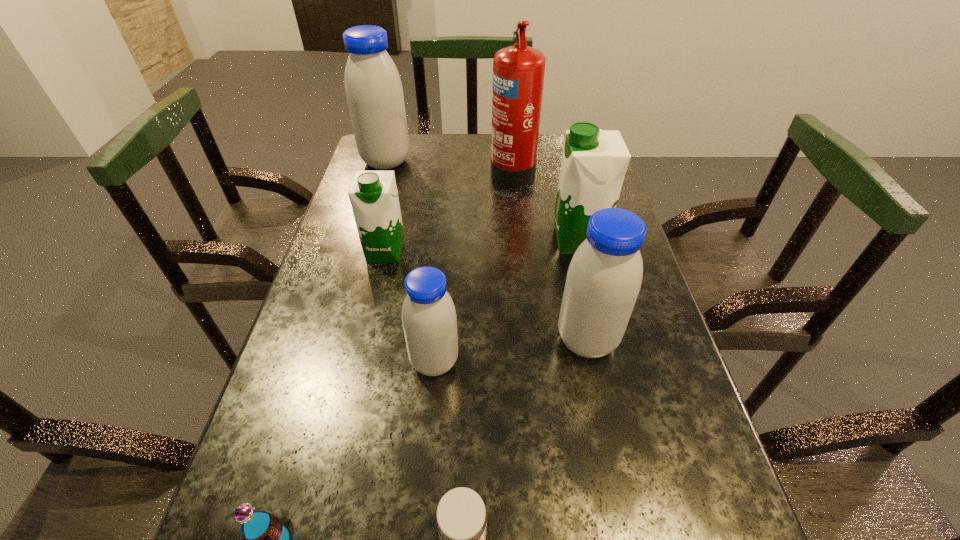
Locate an element on the screen. Image resolution: width=960 pixels, height=540 pixels. red fire extinguisher is located at coordinates (518, 71).

Locate an element on the screen. This screenshot has width=960, height=540. the biggest blue soya milk is located at coordinates (373, 87).

Identify the location of the seventh shortest object. (373, 87).

In order to click on the bigger green soya milk in this screenshot , I will do `click(594, 161)`.

Locate an element on the screen. The width and height of the screenshot is (960, 540). the rightmost blue soya milk is located at coordinates (604, 277).

Where is `the smaller green soya milk`? the smaller green soya milk is located at coordinates coord(373,195).

This screenshot has width=960, height=540. I want to click on the third soya milk from right to left, so click(429, 320).

This screenshot has width=960, height=540. Identify the location of the smallest blue soya milk. (429, 320).

This screenshot has height=540, width=960. Find the location of `vacant space located 0.200m on the surface of the red fire extinguisher`. vacant space located 0.200m on the surface of the red fire extinguisher is located at coordinates [x=424, y=170].

You are a GUI agent. You are given a task and a screenshot of the screen. Output one action in this format:
    pyautogui.click(x=<x>, y=<y>)
    Task: Click on the vacant region located on the surface of the red fire extinguisher
    
    Given the screenshot: What is the action you would take?
    pyautogui.click(x=392, y=170)